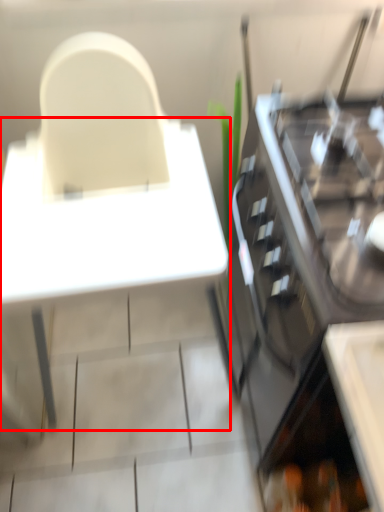
Question: From the image's perspective, considering the relative positions of table (annotated by the red box) and cabinetry in the image provided, where is table (annotated by the red box) located with respect to the staircase?

Choices:
 (A) below
 (B) above

Answer: (B)